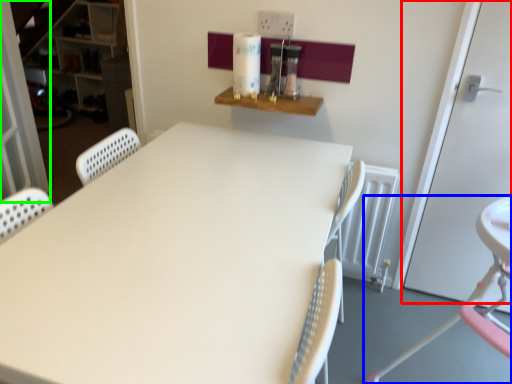
Question: Which is farther away from door (highlighted by a red box)? chair (highlighted by a blue box) or screen door (highlighted by a green box)?

Choices:
 (A) chair
 (B) screen door

Answer: (B)